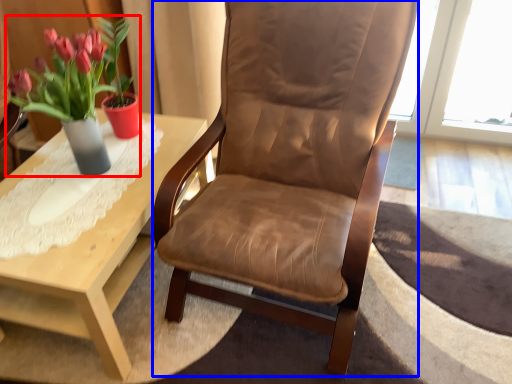
Question: Which object is closer to the camera taking this photo, houseplant (highlighted by a red box) or chair (highlighted by a blue box)?

Choices:
 (A) houseplant
 (B) chair

Answer: (B)